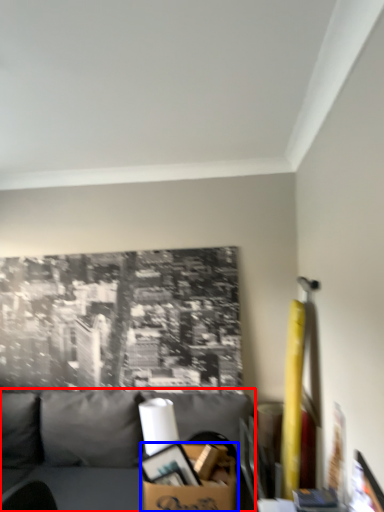
Question: Which object appears closest to the camera in this image, studio couch (highlighted by a red box) or cardboard box (highlighted by a blue box)?

Choices:
 (A) studio couch
 (B) cardboard box

Answer: (A)